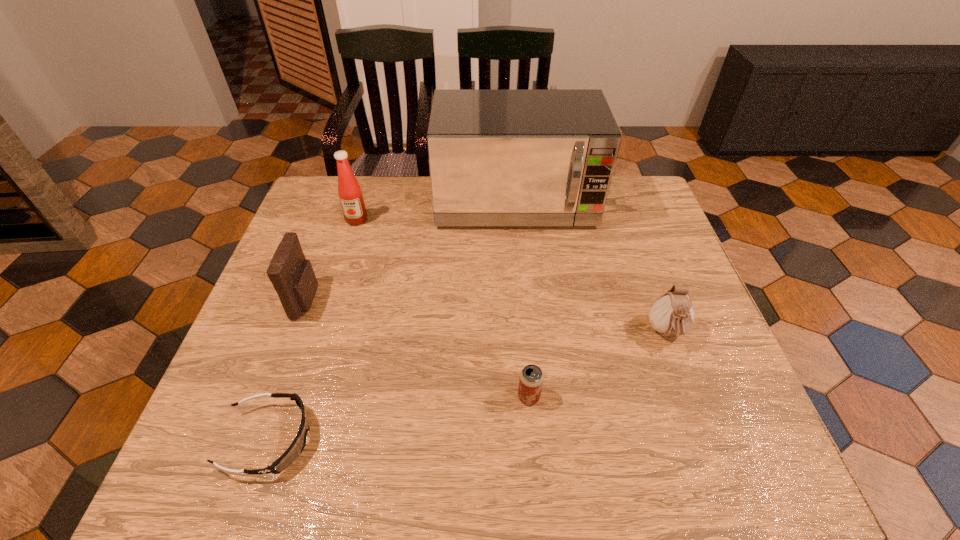
Find the location of a particular element. The image size is (960, 540). free area in between the goggles and the shorter pouch is located at coordinates (468, 386).

At what (x,y) coordinates should I click in order to perform the action: click on free space between the goggles and the taller pouch. Please return your answer as a coordinate pair (x, y). The image size is (960, 540). Looking at the image, I should click on (288, 369).

Where is `vacant space that is in between the taller pouch and the second shortest object`? vacant space that is in between the taller pouch and the second shortest object is located at coordinates (418, 348).

At what (x,y) coordinates should I click in order to perform the action: click on empty space that is in between the fourth shortest object and the shorter pouch. Please return your answer as a coordinate pair (x, y). The image size is (960, 540). Looking at the image, I should click on (487, 316).

The width and height of the screenshot is (960, 540). In order to click on empty location between the left pouch and the third shortest object in this screenshot , I will do 487,316.

At what (x,y) coordinates should I click in order to perform the action: click on blank region between the condiment and the second shortest object. Please return your answer as a coordinate pair (x, y). The width and height of the screenshot is (960, 540). Looking at the image, I should click on (443, 308).

Identify the location of vacant area that lies between the left pouch and the condiment. (x=332, y=260).

Locate an element on the screen. The width and height of the screenshot is (960, 540). object that is the second closest one to the third tallest object is located at coordinates (349, 191).

Where is `object that stands as the fourth closest to the third tallest object`? This screenshot has height=540, width=960. object that stands as the fourth closest to the third tallest object is located at coordinates (531, 378).

I want to click on free space that satisfies the following two spatial constraints: 1. on the front-facing side of the fifth shortest object; 2. with an open flap on the fourth shortest object, so click(x=332, y=300).